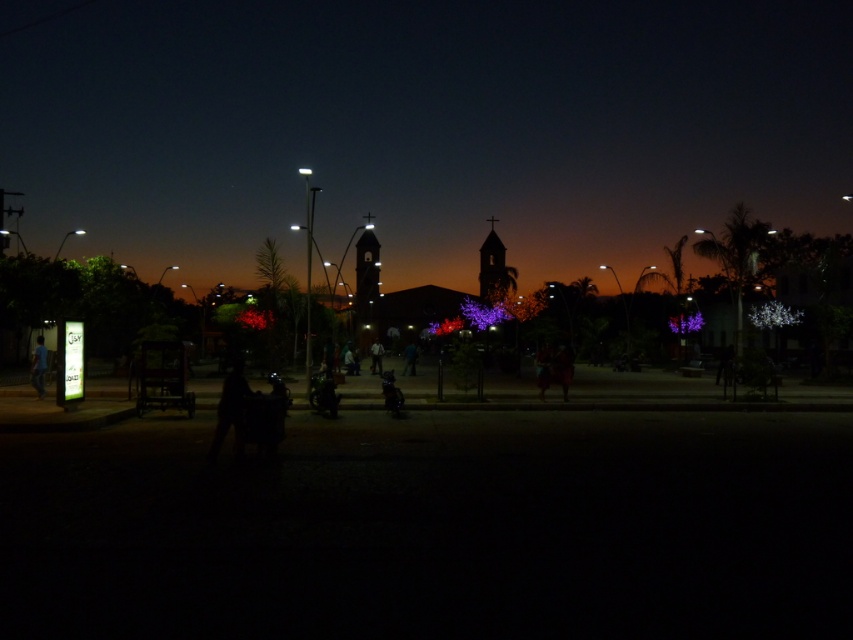
Is matte brown bell tower at center shorter than blue fabric person at lower left?

No.

Based on the photo, who is more forward, (x=498, y=269) or (x=44, y=352)?

Point (x=44, y=352) is in front.

Who is more distant from viewer, (480, 246) or (41, 374)?

Point (480, 246)

At what (x,y) coordinates should I click in order to perform the action: click on matte brown bell tower at center. Please return your answer as a coordinate pair (x, y). This screenshot has height=640, width=853. Looking at the image, I should click on tap(494, 266).

Is point (364, 275) closer to camera compared to point (42, 381)?

That is False.

Is matte glass bell tower at center bigger than blue fabric person at lower left?

Yes.

What are the coordinates of `matte glass bell tower at center` in the screenshot? It's located at (366, 275).

This screenshot has height=640, width=853. Find the location of `matte glass bell tower at center`. matte glass bell tower at center is located at coordinates (366, 275).

Which is below, matte glass bell tower at center or matte brown bell tower at center?

matte brown bell tower at center is below.

Find the location of a particular element. matte glass bell tower at center is located at coordinates (366, 275).

Who is more forward, (x=355, y=248) or (x=506, y=278)?

Point (x=506, y=278) is in front.

Identify the location of matte glass bell tower at center. (366, 275).